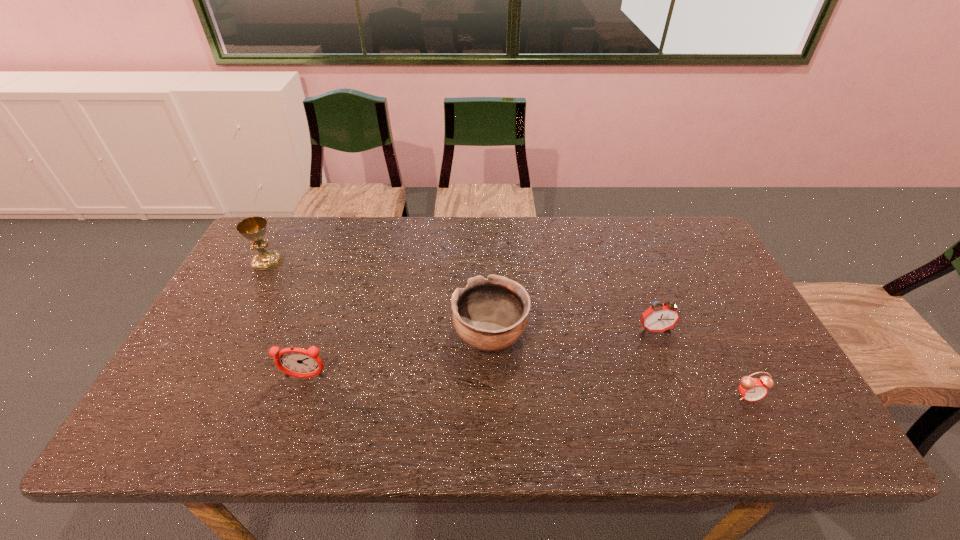
Locate an element on the screen. This screenshot has width=960, height=540. free space located 0.140m on the left of the pottery is located at coordinates (400, 335).

Locate an element on the screen. The image size is (960, 540). vacant space located 0.060m on the front-facing side of the second object from left to right is located at coordinates (296, 404).

Identify the location of vacant area situated 0.170m on the clock face of the second object from right to left. 678,391.

Image resolution: width=960 pixels, height=540 pixels. I want to click on object at the far edge, so click(x=254, y=228).

Locate an element on the screen. object that is at the left edge is located at coordinates (254, 228).

Image resolution: width=960 pixels, height=540 pixels. What are the coordinates of `object that is at the right edge` in the screenshot? It's located at (752, 389).

Where is `object positioned at the far left corner`? object positioned at the far left corner is located at coordinates (254, 228).

Identify the location of vacant space at the far edge of the desktop. This screenshot has width=960, height=540. (x=444, y=261).

What are the coordinates of `free space at the near edge` in the screenshot? It's located at (399, 443).

Where is `free space at the left edge of the desktop`? Image resolution: width=960 pixels, height=540 pixels. free space at the left edge of the desktop is located at coordinates (257, 314).